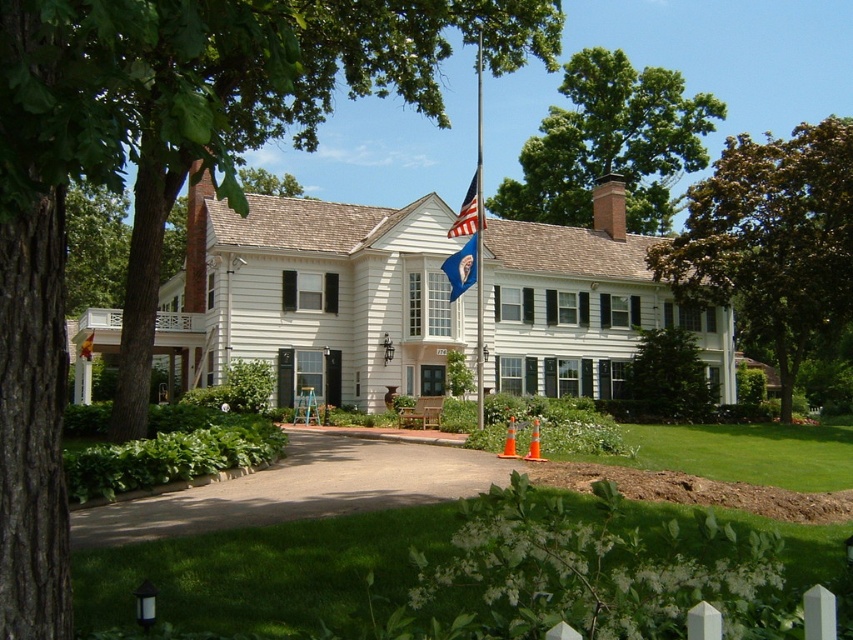
Question: Estimate the real-world distances between objects in this image. Which object is farther from the brown textured tree at upper right?

Choices:
 (A) metallic flag pole at center
 (B) american flag at center
 (C) green leafy tree at upper center
 (D) smooth asphalt driveway at center

Answer: (A)

Question: Is the position of white wood house at center more distant than that of green leafy tree at center?

Choices:
 (A) yes
 (B) no

Answer: (B)

Question: Which point is closer to the camera?

Choices:
 (A) smooth asphalt driveway at center
 (B) american flag at center
 (C) green leafy tree at upper left

Answer: (C)

Question: Which point is farther to the camera?

Choices:
 (A) pos(688,385)
 (B) pos(634,68)
 (C) pos(619,467)
 (D) pos(480,356)

Answer: (B)

Question: Is green leafy tree at upper left to the left of green leafy tree at upper center from the viewer's perspective?

Choices:
 (A) yes
 (B) no

Answer: (A)

Question: Is white wood house at center in front of american flag at center?

Choices:
 (A) no
 (B) yes

Answer: (B)